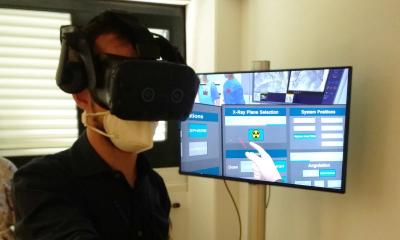
The width and height of the screenshot is (400, 240). In order to click on wall space above tv in this screenshot , I will do `click(294, 39)`.